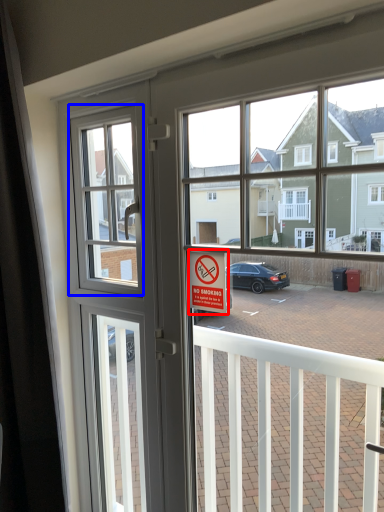
Question: Which point is closer to the camera, parking sign (highlighted by a red box) or window screen (highlighted by a blue box)?

Choices:
 (A) parking sign
 (B) window screen

Answer: (A)